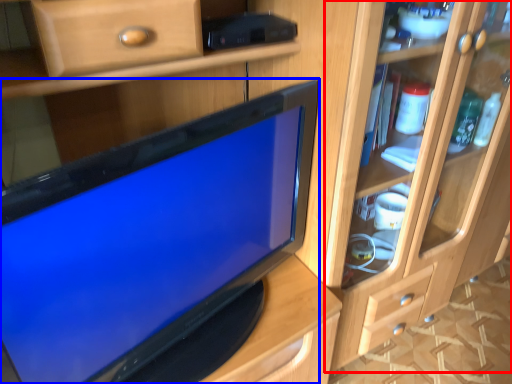
Question: Which object is further to the camera taking this photo, dresser (highlighted by a red box) or television (highlighted by a blue box)?

Choices:
 (A) dresser
 (B) television

Answer: (A)